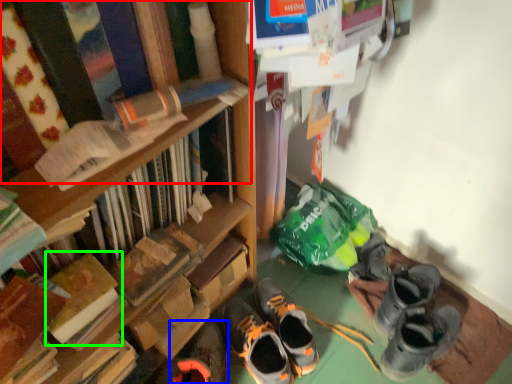
Question: Which is nearer to the book (highlighted by a red box)? footwear (highlighted by a blue box) or book (highlighted by a green box).

Choices:
 (A) footwear
 (B) book

Answer: (B)